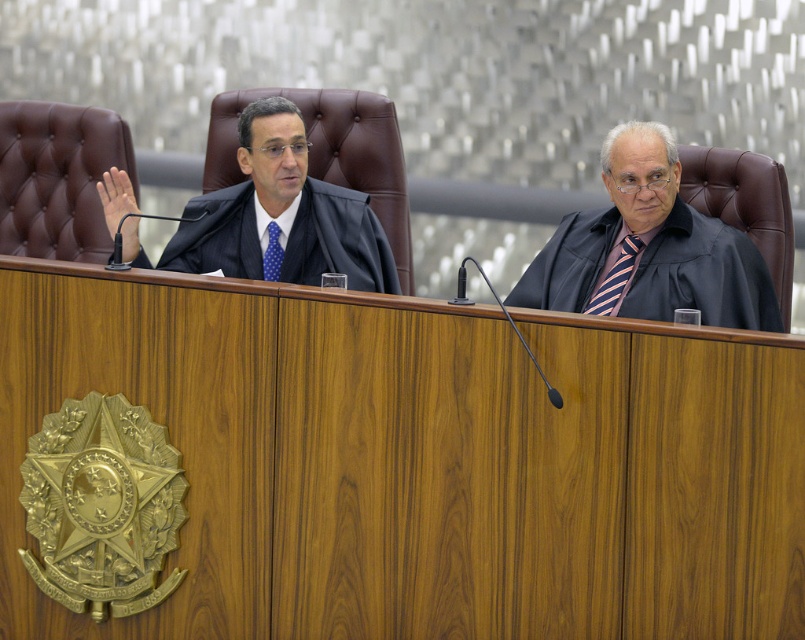
Can you confirm if matte black robe at right is taller than blue dotted tie at center?

Yes, matte black robe at right is taller than blue dotted tie at center.

Is matte black robe at right to the left of blue dotted tie at center from the viewer's perspective?

No, matte black robe at right is not to the left of blue dotted tie at center.

In the scene shown: Who is more distant from viewer, (675, 241) or (267, 230)?

The point (267, 230) is behind.

Identify the location of matte black robe at right. (702, 275).

Where is `matte black robe at left`? matte black robe at left is located at coordinates (337, 241).

Between point (174, 241) and point (275, 236), which one is positioned in front?

Point (275, 236) is more forward.

The height and width of the screenshot is (640, 805). Identify the location of matte black robe at left. (337, 241).

Image resolution: width=805 pixels, height=640 pixels. What are the coordinates of `matte black robe at right` in the screenshot? It's located at (702, 275).

Which of these two, matte black robe at right or striped fabric tie at right, stands shorter?

striped fabric tie at right is shorter.

Is point (593, 228) positioned after point (612, 273)?

That is True.

Locate an element on the screen. matte black robe at right is located at coordinates (702, 275).